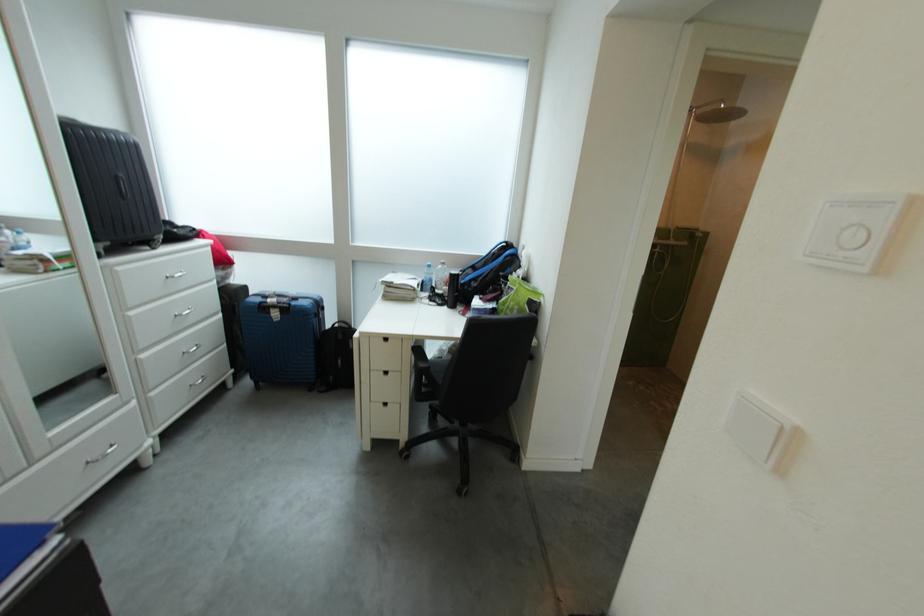
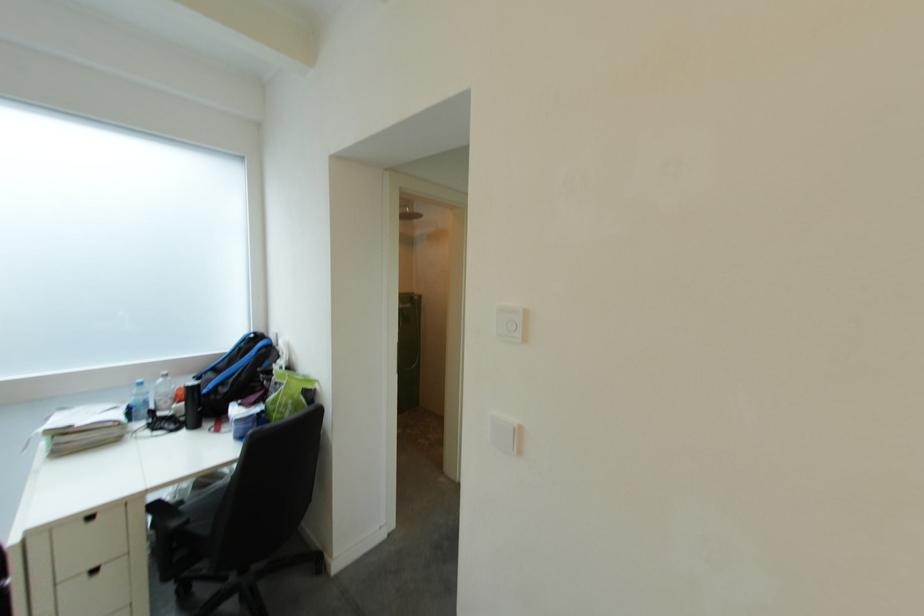
Locate, in the second image, the point that corresponds to point (527, 315) in the first image.

(301, 410)